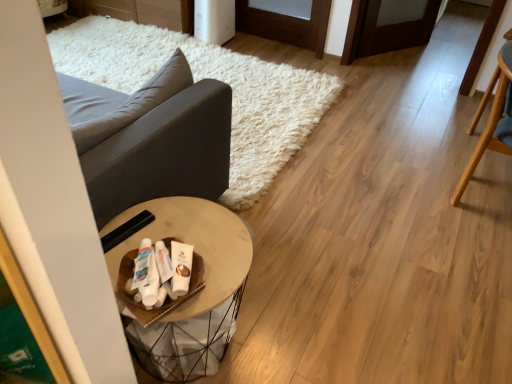
Where is `free space above wooden round table at center (from a real-world perspective)`? The image size is (512, 384). free space above wooden round table at center (from a real-world perspective) is located at coordinates (185, 241).